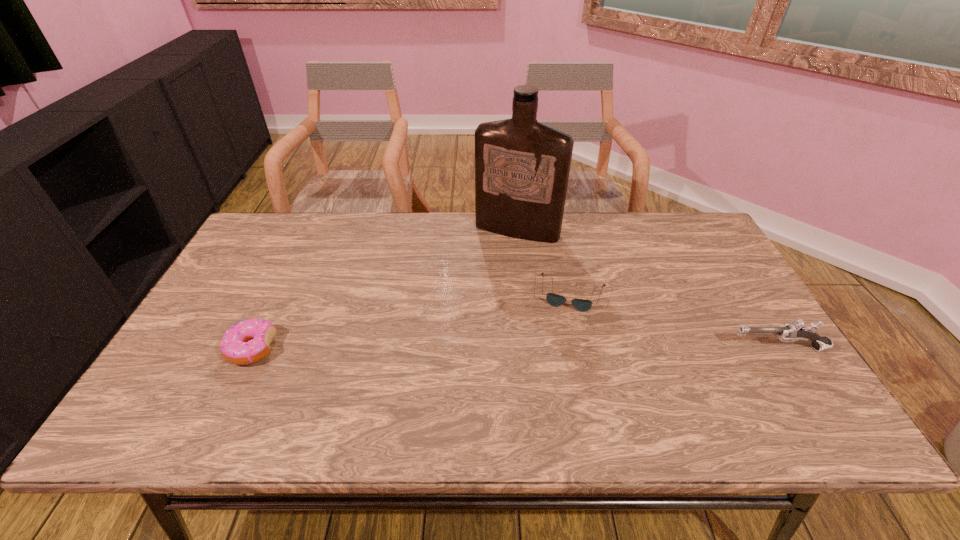
Image resolution: width=960 pixels, height=540 pixels. Identify the location of blank area located aimed along the barrel of the gun. (630, 348).

This screenshot has height=540, width=960. I want to click on free space located 0.200m aimed along the barrel of the gun, so click(650, 348).

Where is `vacant space located 0.120m on the label side of the farthest object`? vacant space located 0.120m on the label side of the farthest object is located at coordinates (493, 267).

Locate an element on the screen. This screenshot has height=540, width=960. vacant space situated 0.360m on the label side of the farthest object is located at coordinates (466, 323).

Locate an element on the screen. This screenshot has height=540, width=960. vacant space located 0.130m on the label side of the farthest object is located at coordinates (492, 268).

Identify the location of vacant space situated on the lenses of the shortest object. Image resolution: width=960 pixels, height=540 pixels. (564, 338).

Find the location of a particular element. The image size is (960, 540). free region located on the lenses of the shortest object is located at coordinates (558, 368).

Find the location of a particular element. This screenshot has width=960, height=540. free location located 0.100m on the lenses of the shortest object is located at coordinates (563, 340).

You are a GUI agent. You are given a task and a screenshot of the screen. Output one action in this format:
    pyautogui.click(x=<x>, y=<y>)
    Task: Click on the object located in the far edge section of the desktop
    
    Given the screenshot: What is the action you would take?
    pyautogui.click(x=522, y=167)

The height and width of the screenshot is (540, 960). In order to click on object positioned at the near edge in this screenshot , I will do `click(247, 342)`.